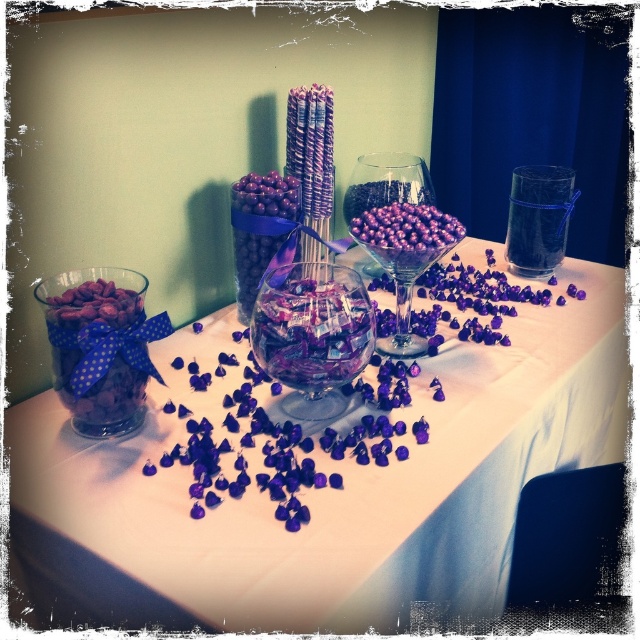
Is translucent glass vase at center positioned before transparent glass bowl at center?

Yes, translucent glass vase at center is closer to the viewer.

Is point (266, 497) positioned in front of point (294, 282)?

Yes, it is.

Where is `translucent glass vase at center`? translucent glass vase at center is located at coordinates (x=324, y=488).

Between point (125, 298) and point (417, 241), which one is positioned in front?

Positioned in front is point (125, 298).

Which of these two, matte purple candy at left or translucent glass martini glass at center, stands shorter?

Standing shorter between the two is matte purple candy at left.

Between point (128, 419) and point (381, 348), which one is positioned in front?

Point (128, 419) is more forward.

At what (x,y) coordinates should I click in order to perform the action: click on matte purple candy at left. Please return your answer as a coordinate pair (x, y). Image resolution: width=640 pixels, height=640 pixels. Looking at the image, I should click on (100, 346).

Between translucent glass martini glass at center and purple glossy chocolate at center, which one appears on the right side from the viewer's perspective?

translucent glass martini glass at center

Is translucent glass martini glass at center in front of purple glossy chocolate at center?

No, it is not.

The image size is (640, 640). What are the coordinates of `translucent glass martini glass at center` in the screenshot? It's located at coord(404,259).

Where is `translucent glass martini glass at center`? This screenshot has height=640, width=640. translucent glass martini glass at center is located at coordinates (404, 259).